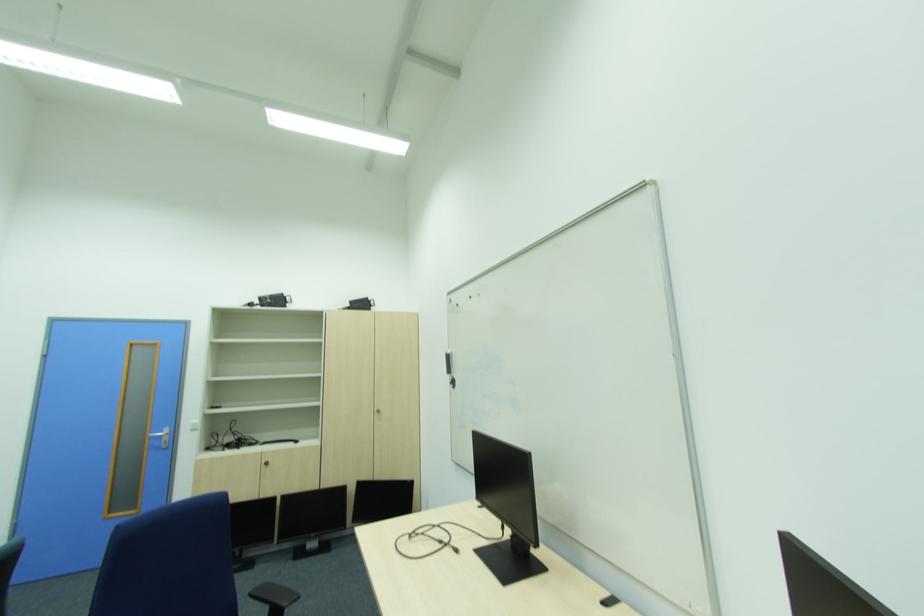
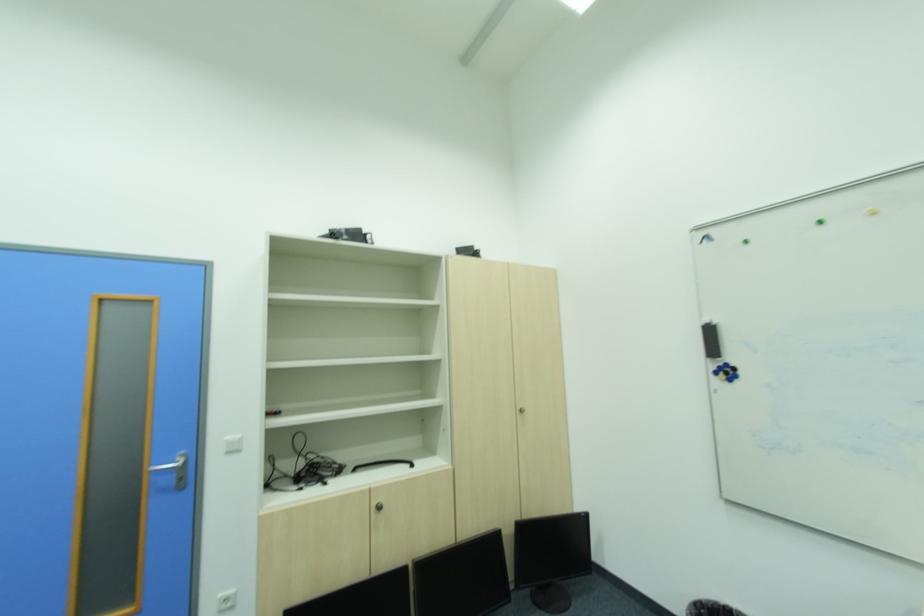
The point at (168, 432) is marked in the first image. Where is the corresponding point in the second image?

(180, 463)